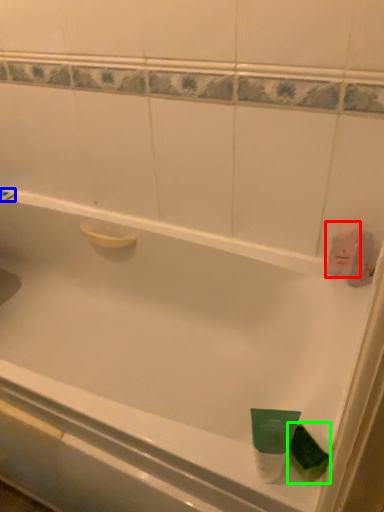
Question: Based on their relative distances, which object is nearer to mouthwash (highlighted by a red box)? Choose from shower (highlighted by a blue box) and mouthwash (highlighted by a green box).

Choices:
 (A) shower
 (B) mouthwash

Answer: (B)